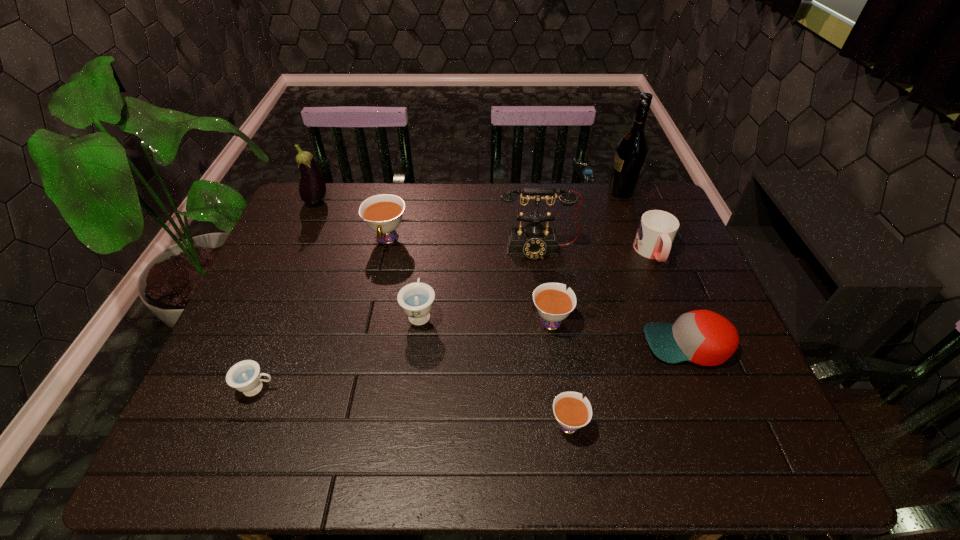
Find the location of a particular element. The height and width of the screenshot is (540, 960). free region located 0.340m on the side of the seventh object from right to left with the handle is located at coordinates (432, 217).

At what (x,y) coordinates should I click in order to perform the action: click on free space located 0.130m on the side of the nearest white teacup with the handle. Please return your answer as a coordinate pair (x, y). The width and height of the screenshot is (960, 540). Looking at the image, I should click on (558, 353).

Where is `vacant space located on the side of the nearest white teacup with the handle`? The height and width of the screenshot is (540, 960). vacant space located on the side of the nearest white teacup with the handle is located at coordinates (553, 320).

Identify the location of vacant space situated on the side of the nearest white teacup with the handle. Image resolution: width=960 pixels, height=540 pixels. click(548, 288).

Find the location of a particular element. The image size is (960, 540). free location located 0.190m on the side of the smaller blue teacup with the handle is located at coordinates (363, 388).

Locate an element on the screen. wine bottle that is at the far edge is located at coordinates (631, 152).

Locate an element on the screen. eggplant present at the far edge is located at coordinates (312, 187).

At what (x,y) coordinates should I click in order to perform the action: click on teacup that is at the far edge. Please return your answer as a coordinate pair (x, y). The width and height of the screenshot is (960, 540). Looking at the image, I should click on (382, 213).

Where is `object located in the near edge section of the desktop`? Image resolution: width=960 pixels, height=540 pixels. object located in the near edge section of the desktop is located at coordinates (571, 412).

The image size is (960, 540). What are the coordinates of `eggplant that is at the left edge` in the screenshot? It's located at (312, 187).